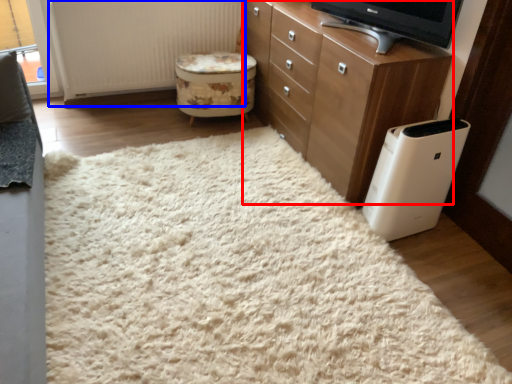
Question: Which object appears farthest to the camera in this image, chest of drawers (highlighted by a red box) or radiator (highlighted by a blue box)?

Choices:
 (A) chest of drawers
 (B) radiator

Answer: (B)